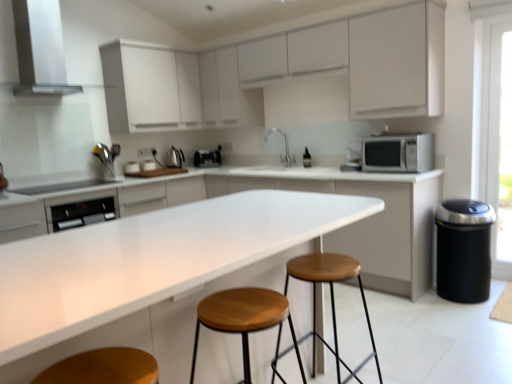
This screenshot has width=512, height=384. In order to click on free point above wooden seat stool at center, positioned as the 1th stool in front-to-back order (from a real-world perspective) in this screenshot , I will do `click(250, 299)`.